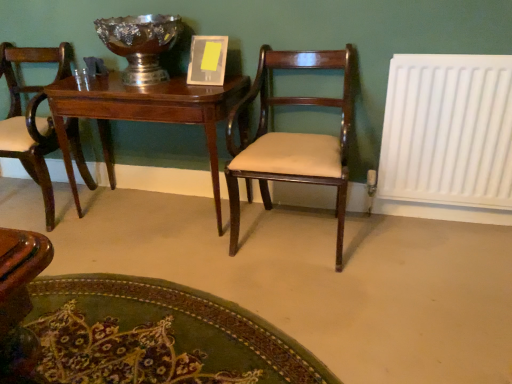
Image resolution: width=512 pixels, height=384 pixels. I want to click on vacant point to the right of mahogany wood chair at center, acting as the first chair starting from the right, so click(x=394, y=248).